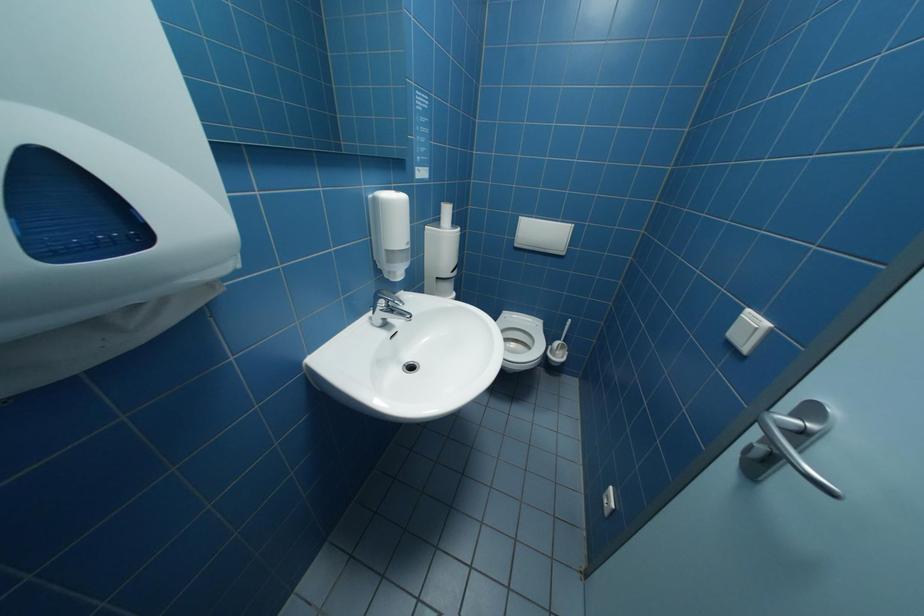
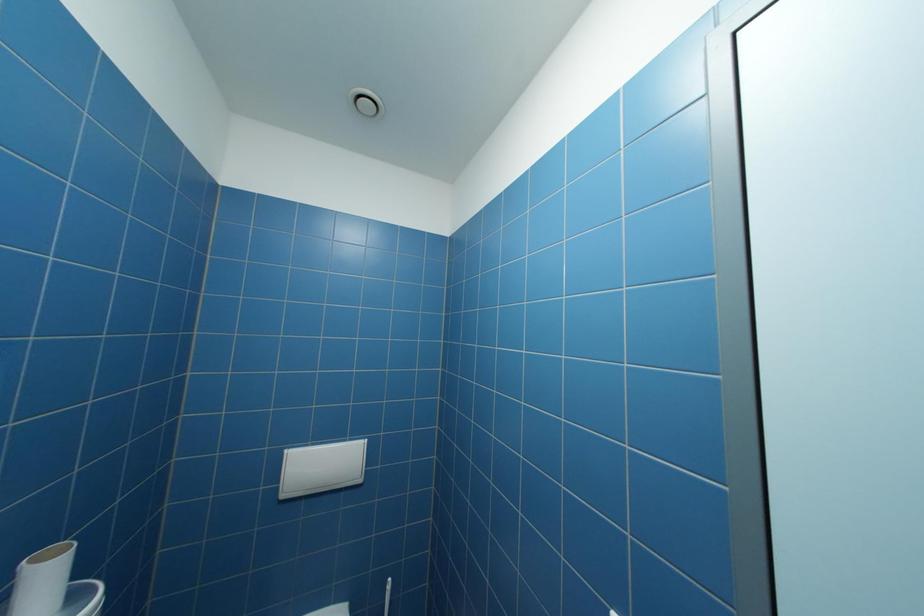
The images are taken continuously from a first-person perspective. In which direction is your viewpoint rotating?

The camera's rotation is toward right-up.